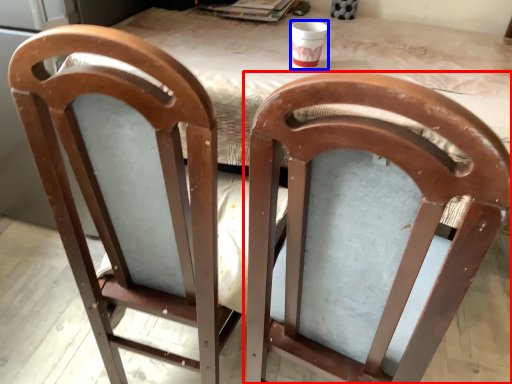
Question: Among these objects, which one is farthest to the camera, chair (highlighted by a red box) or cup (highlighted by a blue box)?

Choices:
 (A) chair
 (B) cup

Answer: (B)